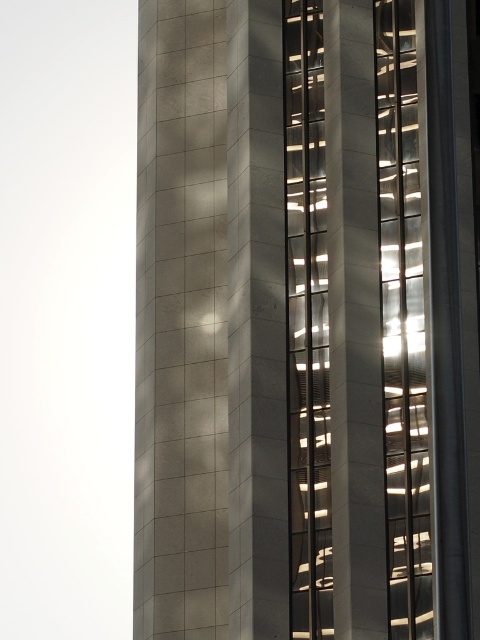
Who is positioned more to the left, satin concrete tower at center or transparent glass elevator at center?

satin concrete tower at center is more to the left.

The width and height of the screenshot is (480, 640). What are the coordinates of `satin concrete tower at center` in the screenshot? It's located at (307, 321).

Is metallic reflective glass at right positioned in front of transparent glass elevator at center?

Yes.

Find the location of a particular element. metallic reflective glass at right is located at coordinates (403, 324).

At what (x,y) coordinates should I click in order to perform the action: click on metallic reflective glass at right. Please return your answer as a coordinate pair (x, y). This screenshot has width=480, height=640. Looking at the image, I should click on (403, 324).

At what (x,y) coordinates should I click in order to perform the action: click on metallic reflective glass at right. Please return your answer as a coordinate pair (x, y). This screenshot has width=480, height=640. Looking at the image, I should click on (403, 324).

Does satin concrete tower at center appear under metallic reflective glass at right?

Yes.

Is satin concrete tower at center closer to camera compared to metallic reflective glass at right?

Yes.

Which is behind, point (275, 582) or point (386, 188)?

The point (386, 188) is more distant.

You are a GUI agent. You are given a task and a screenshot of the screen. Output one action in this format:
    pyautogui.click(x=<x>, y=<y>)
    Task: Click on the satin concrete tower at center
    The image size is (480, 640).
    Given the screenshot: What is the action you would take?
    pyautogui.click(x=307, y=321)